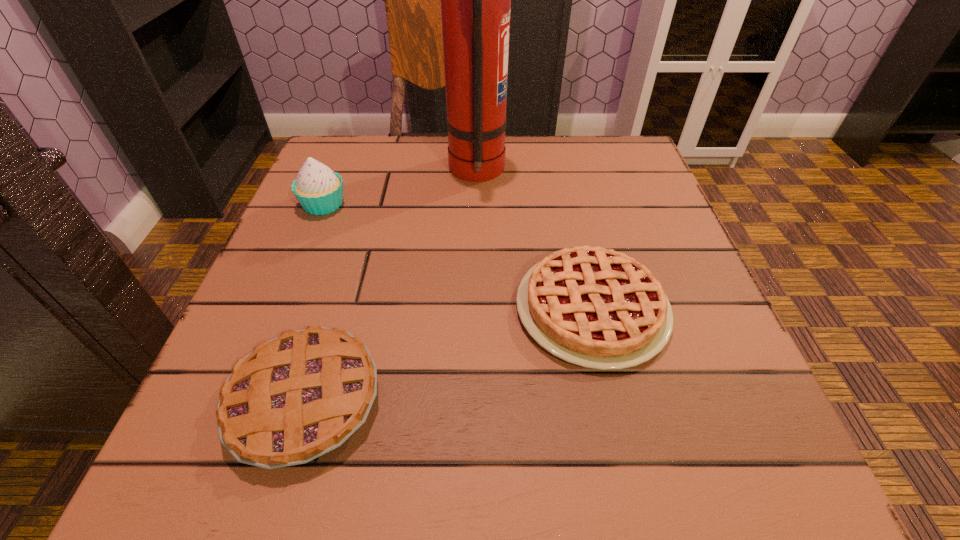
Where is `vacant space that satisfies the following two spatial constraints: 1. on the label side of the third object from left to right; 2. on the right side of the rightmost object`? This screenshot has height=540, width=960. vacant space that satisfies the following two spatial constraints: 1. on the label side of the third object from left to right; 2. on the right side of the rightmost object is located at coordinates (475, 309).

Find the location of `free region that satisfies the following two spatial constraints: 1. on the label side of the fire extinguisher; 2. on the right side of the right pie`. free region that satisfies the following two spatial constraints: 1. on the label side of the fire extinguisher; 2. on the right side of the right pie is located at coordinates (475, 309).